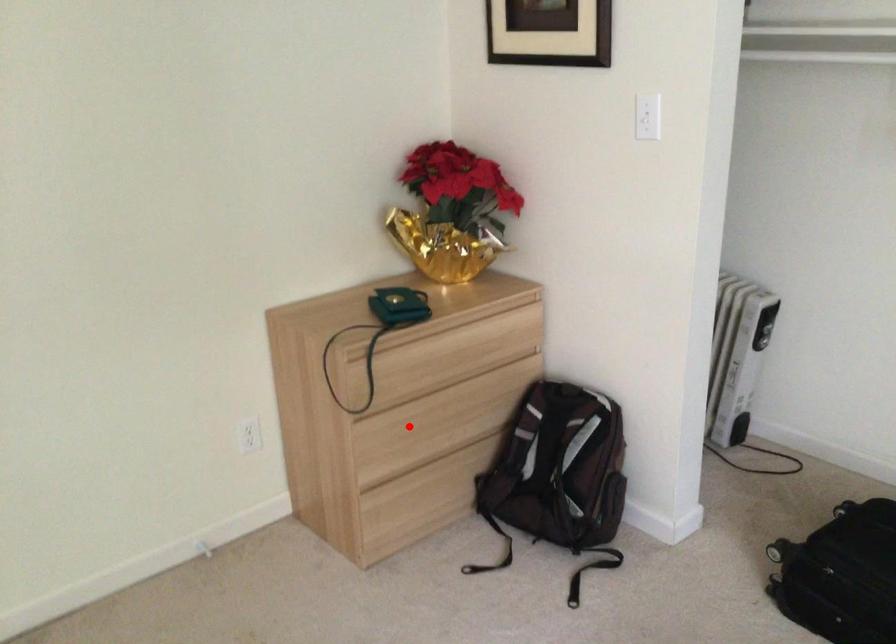
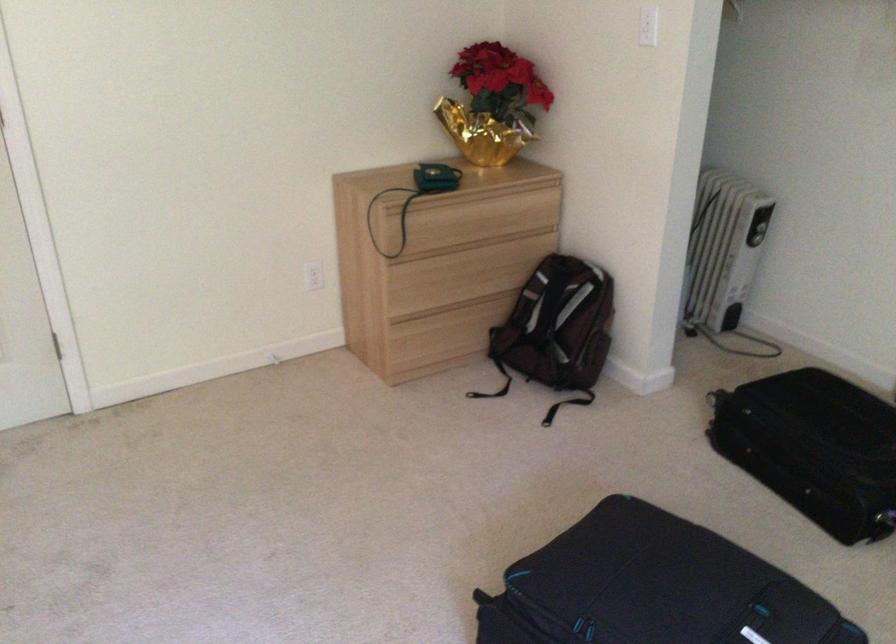
Find the pixel in the second image that matches the highlighted location in the first image.

(435, 277)